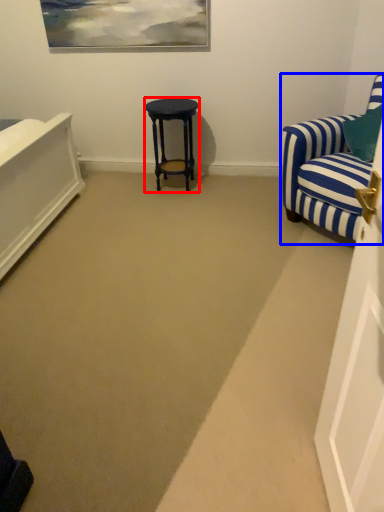
Question: Which of the following is the farthest to the observer, stool (highlighted by a red box) or chair (highlighted by a blue box)?

Choices:
 (A) stool
 (B) chair

Answer: (A)